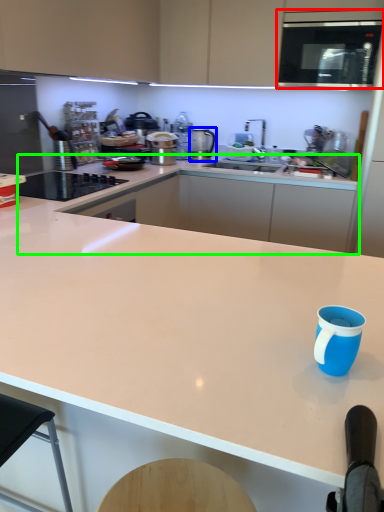
Question: Estimate the real-world distances between objects in this image. Which object is closer to microwave oven (highlighted by a red box), kitchen appliance (highlighted by a blue box) or countertop (highlighted by a green box)?

Choices:
 (A) kitchen appliance
 (B) countertop

Answer: (B)